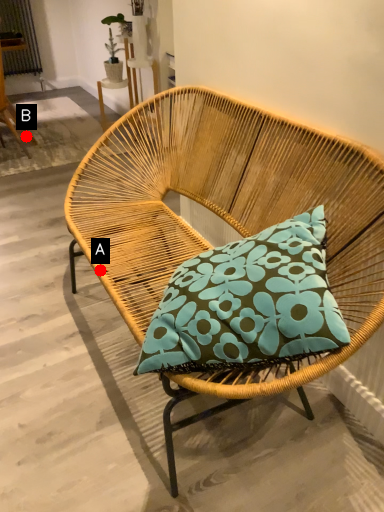
Question: Two points are circled on the image, labeled by A and B beside each circle. Which point is farther from the camera taking this photo?

Choices:
 (A) A is further
 (B) B is further

Answer: (B)